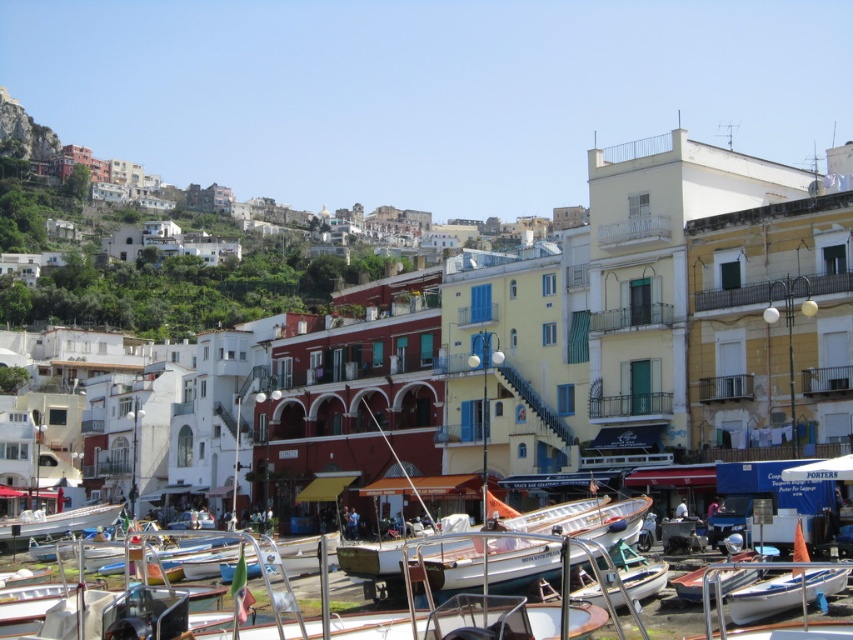
Is white matte building at center thinner than white glossy boat at lower right?

Incorrect, white matte building at center's width is not less than white glossy boat at lower right's.

Between white matte building at center and white glossy boat at lower right, which one has more height?

white matte building at center is taller.

The image size is (853, 640). Identify the location of white matte building at center. (479, 355).

Where is `white matte building at center`? white matte building at center is located at coordinates (479, 355).

Consider the image. Is white matte building at center shorter than white wooden boat at lower right?

No.

Where is `white matte building at center`? white matte building at center is located at coordinates (479, 355).

Is white glossy boat at lower right further to camera compared to white wooden boat at lower right?

No, it is in front of white wooden boat at lower right.

Can you confirm if white glossy boat at lower right is wider than white wooden boat at lower right?

Indeed, white glossy boat at lower right has a greater width compared to white wooden boat at lower right.

Is point (753, 602) farther from camera compared to point (692, 586)?

No, it is not.

Locate an element on the screen. This screenshot has width=853, height=640. white glossy boat at lower right is located at coordinates (784, 593).